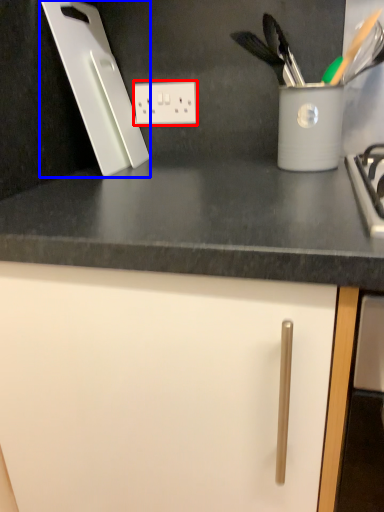
Question: Which of the following is the closest to the observer, electric outlet (highlighted by a red box) or kitchen appliance (highlighted by a blue box)?

Choices:
 (A) electric outlet
 (B) kitchen appliance

Answer: (B)